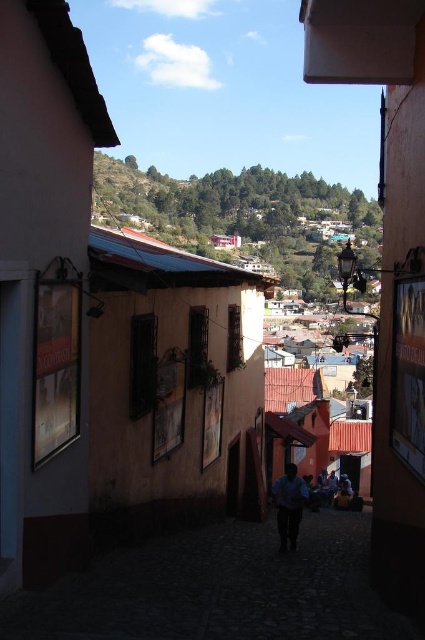
You are a tourist standing in front of the dark stone alley at center in this historic town. You want to take a photo of the alley from where you are standing. Considering the distance between you and the alley, is it possible to capture the entire alley in one frame without moving closer or further away?

The dark stone alley at center is 13.60 meters away from your current position. Since this distance allows for a wide enough angle to include the entire alley in the frame without needing to adjust your position, you can capture the entire alley in one photo.